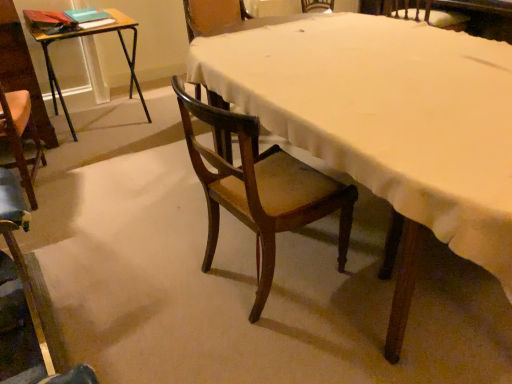
Question: Considering the relative sizes of wooden chair at center, arranged as the second chair when viewed from the right, and wooden desk at left in the image provided, is wooden chair at center, arranged as the second chair when viewed from the right, bigger than wooden desk at left?

Choices:
 (A) yes
 (B) no

Answer: (B)

Question: From a real-world perspective, is wooden chair at center, arranged as the second chair when viewed from the right, below wooden desk at left?

Choices:
 (A) yes
 (B) no

Answer: (B)

Question: Can you confirm if wooden chair at center, positioned as the third chair in left-to-right order, is wider than wooden desk at left?

Choices:
 (A) no
 (B) yes

Answer: (A)

Question: Is wooden chair at center, arranged as the second chair when viewed from the right, in front of wooden desk at left?

Choices:
 (A) yes
 (B) no

Answer: (A)

Question: From a real-world perspective, does wooden chair at center, positioned as the third chair in left-to-right order, stand above wooden desk at left?

Choices:
 (A) no
 (B) yes

Answer: (B)

Question: Does point (47, 329) appear closer or farther from the camera than point (431, 21)?

Choices:
 (A) farther
 (B) closer

Answer: (B)

Question: Considering the positions of wooden chair at lower left, the 1th chair viewed from the left, and wooden chair at upper right, arranged as the fourth chair when viewed from the left, in the image, is wooden chair at lower left, the 1th chair viewed from the left, taller or shorter than wooden chair at upper right, arranged as the fourth chair when viewed from the left,?

Choices:
 (A) short
 (B) tall

Answer: (B)

Question: From the image's perspective, is wooden chair at lower left, the 1th chair viewed from the left, above or below wooden chair at upper right, marked as the first chair in a right-to-left arrangement?

Choices:
 (A) below
 (B) above

Answer: (A)

Question: Would you say wooden chair at lower left, the 1th chair viewed from the left, is inside or outside wooden chair at upper right, marked as the first chair in a right-to-left arrangement?

Choices:
 (A) inside
 (B) outside

Answer: (B)

Question: Would you say wooden chair at center is to the left or to the right of wooden chair at lower left, the 1th chair viewed from the left, in the picture?

Choices:
 (A) left
 (B) right

Answer: (B)

Question: Is wooden chair at center spatially inside wooden chair at lower left, the 1th chair viewed from the left, or outside of it?

Choices:
 (A) outside
 (B) inside

Answer: (A)

Question: From a real-world perspective, is wooden chair at center above or below wooden chair at lower left, which is the fourth chair in right-to-left order?

Choices:
 (A) below
 (B) above

Answer: (B)

Question: Considering the positions of wooden chair at center and wooden chair at lower left, which is the fourth chair in right-to-left order, in the image, is wooden chair at center bigger or smaller than wooden chair at lower left, which is the fourth chair in right-to-left order,?

Choices:
 (A) big
 (B) small

Answer: (A)

Question: From the image's perspective, is wooden chair at center, arranged as the second chair when viewed from the right, above or below wooden chair at upper right, marked as the first chair in a right-to-left arrangement?

Choices:
 (A) above
 (B) below

Answer: (B)

Question: From a real-world perspective, is wooden chair at center, arranged as the second chair when viewed from the right, above or below wooden chair at upper right, marked as the first chair in a right-to-left arrangement?

Choices:
 (A) below
 (B) above

Answer: (A)